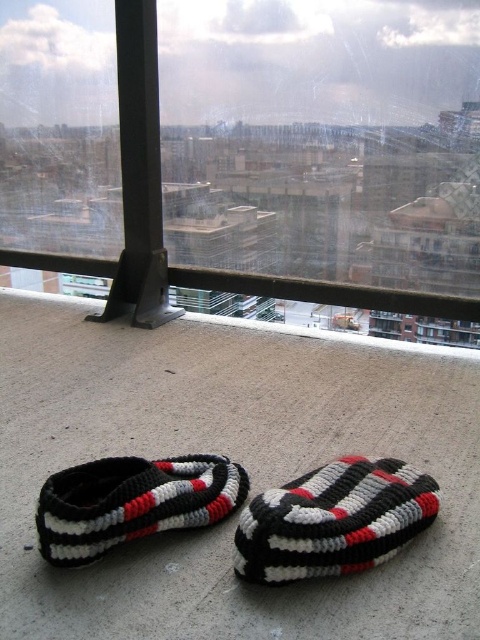
Does transparent glass window at center have a greater height compared to knitted woolen slipper at lower center?

Yes.

Is transparent glass window at center shorter than knitted woolen slipper at lower center?

No.

Which is in front, point (373, 282) or point (235, 496)?

Positioned in front is point (235, 496).

This screenshot has height=640, width=480. What are the coordinates of `transparent glass window at center` in the screenshot? It's located at (250, 152).

Does knitted fabric slipper at lower center appear on the left side of knitted woolen slipper at lower center?

Incorrect, knitted fabric slipper at lower center is not on the left side of knitted woolen slipper at lower center.

Who is lower down, knitted fabric slipper at lower center or knitted woolen slipper at lower center?

knitted fabric slipper at lower center is lower down.

Measure the distance between point [316,474] and camera.

They are 4.52 feet apart.

Find the location of `knitted fabric slipper at lower center`. knitted fabric slipper at lower center is located at coordinates (334, 520).

Which is below, transparent glass window at center or knitted fabric slipper at lower center?

knitted fabric slipper at lower center is lower down.

Is point (35, 170) positioned behind point (292, 513)?

That is True.

The width and height of the screenshot is (480, 640). I want to click on transparent glass window at center, so tap(250, 152).